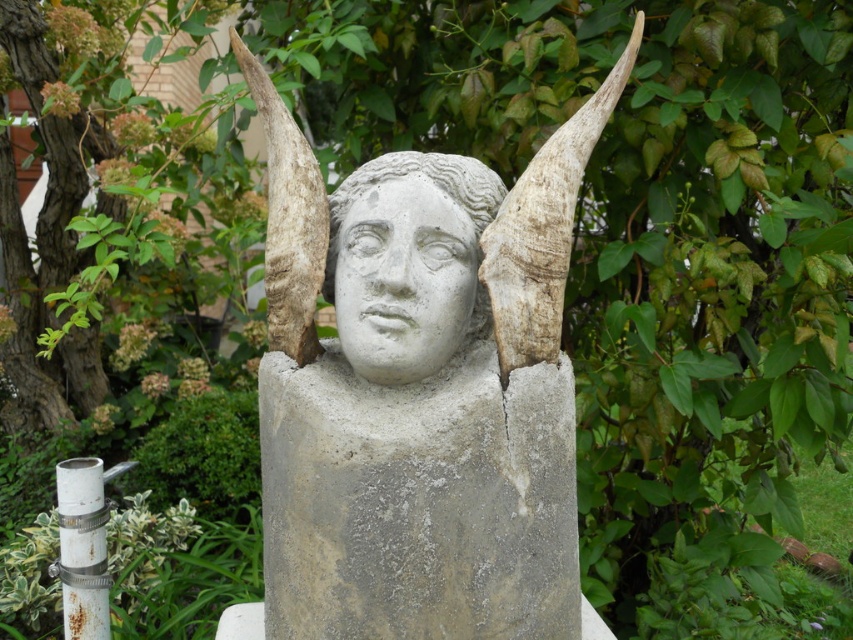
Identify the location of gray stone statue at center. The image size is (853, 640). (419, 390).

Who is more distant from viewer, [489,605] or [450,419]?

Positioned behind is point [489,605].

Is point (367, 266) less distant than point (407, 419)?

That is False.

Identify the location of gray stone statue at center. (419, 390).

Which of these two, gray concrete statue at center or white stone head at center, stands shorter?

With less height is white stone head at center.

Between gray concrete statue at center and white stone head at center, which one appears on the left side from the viewer's perspective?

Positioned to the left is white stone head at center.

What do you see at coordinates (418, 502) in the screenshot? I see `gray concrete statue at center` at bounding box center [418, 502].

Locate an element on the screen. gray concrete statue at center is located at coordinates (418, 502).

Which is in front, point (312, 253) or point (460, 340)?

Positioned in front is point (312, 253).

Can you confirm if gray stone statue at center is wider than white stone head at center?

Indeed, gray stone statue at center has a greater width compared to white stone head at center.

Is point (548, 289) farther from camera compared to point (331, 257)?

No.

In order to click on gray stone statue at center in this screenshot , I will do click(419, 390).